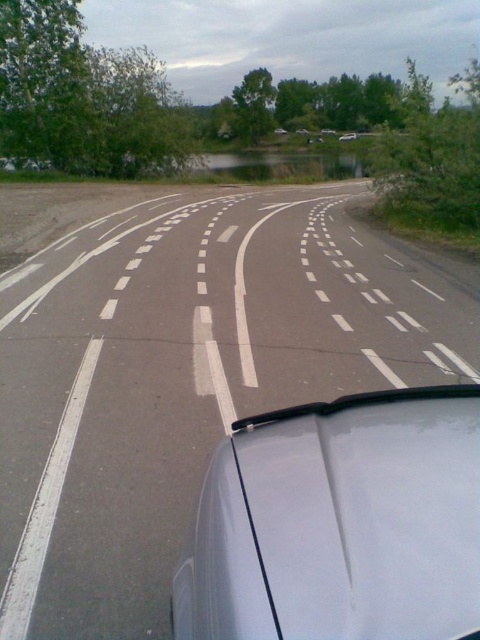
Question: Does white asphalt road at center appear on the left side of white glossy car at center?

Choices:
 (A) no
 (B) yes

Answer: (B)

Question: Among these objects, which one is nearest to the camera?

Choices:
 (A) satin white car at center
 (B) white asphalt road at center
 (C) white glossy car at center

Answer: (A)

Question: Which object is positioned closest to the white asphalt road at center?

Choices:
 (A) satin white car at center
 (B) white glossy car at center

Answer: (A)

Question: Which point is closer to the camera?

Choices:
 (A) (347, 134)
 (B) (21, 272)
 (C) (312, 541)

Answer: (C)

Question: Can you confirm if white asphalt road at center is smaller than white glossy car at center?

Choices:
 (A) yes
 (B) no

Answer: (B)

Question: Does white asphalt road at center have a lesser width compared to white glossy car at center?

Choices:
 (A) yes
 (B) no

Answer: (B)